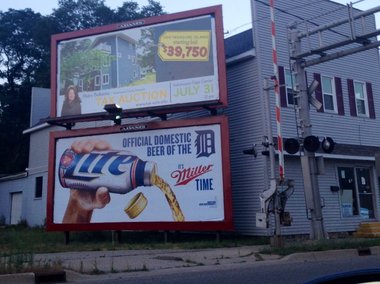
Locate an element on the screen. The height and width of the screenshot is (284, 380). door is located at coordinates (361, 179).